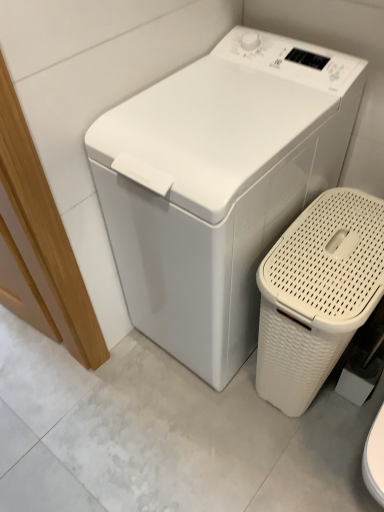
Question: Is white plastic washing machine at center positioned beyond the bounds of white woven basket at lower right?

Choices:
 (A) no
 (B) yes

Answer: (B)

Question: Is white plastic washing machine at center smaller than white woven basket at lower right?

Choices:
 (A) no
 (B) yes

Answer: (A)

Question: From a real-world perspective, is white plastic washing machine at center beneath white woven basket at lower right?

Choices:
 (A) yes
 (B) no

Answer: (B)

Question: Could you tell me if white plastic washing machine at center is facing white woven basket at lower right?

Choices:
 (A) no
 (B) yes

Answer: (A)

Question: Does white plastic washing machine at center have a lesser height compared to white woven basket at lower right?

Choices:
 (A) yes
 (B) no

Answer: (B)

Question: Would you say white plastic washing machine at center is a long distance from white woven basket at lower right?

Choices:
 (A) yes
 (B) no

Answer: (B)

Question: Considering the relative sizes of white woven basket at lower right and white plastic washing machine at center in the image provided, is white woven basket at lower right shorter than white plastic washing machine at center?

Choices:
 (A) yes
 (B) no

Answer: (A)

Question: Does white woven basket at lower right have a larger size compared to white plastic washing machine at center?

Choices:
 (A) no
 (B) yes

Answer: (A)

Question: Does white woven basket at lower right lie behind white plastic washing machine at center?

Choices:
 (A) yes
 (B) no

Answer: (A)

Question: Are white woven basket at lower right and white plastic washing machine at center located far from each other?

Choices:
 (A) yes
 (B) no

Answer: (B)

Question: From the image's perspective, is white woven basket at lower right under white plastic washing machine at center?

Choices:
 (A) no
 (B) yes

Answer: (B)

Question: Is white woven basket at lower right not within white plastic washing machine at center?

Choices:
 (A) no
 (B) yes

Answer: (B)

Question: From a real-world perspective, relative to white plastic washing machine at center, is white woven basket at lower right vertically above or below?

Choices:
 (A) above
 (B) below

Answer: (B)